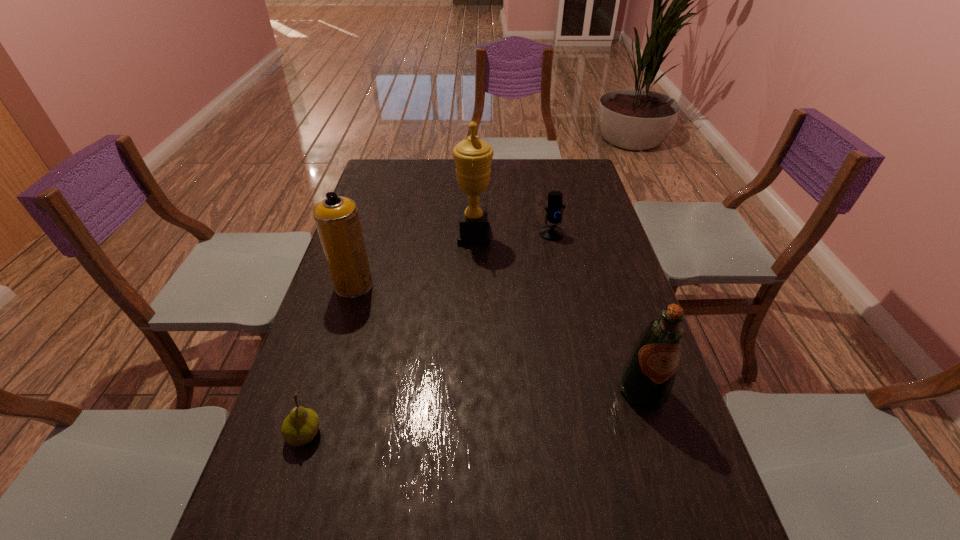
The height and width of the screenshot is (540, 960). I want to click on free space between the fourth farthest object and the microphone, so click(597, 312).

At what (x,y) coordinates should I click in order to perform the action: click on object that stands as the second closest to the aerosol can. Please return your answer as a coordinate pair (x, y). This screenshot has height=540, width=960. Looking at the image, I should click on (300, 427).

Locate which object is the fourth closest to the shortest object. Please provide its 2D coordinates. Your answer should be formatted as a tuple, i.e. [(x, y)], where the tuple contains the x and y coordinates of a point satisfying the conditions above.

[(554, 212)]